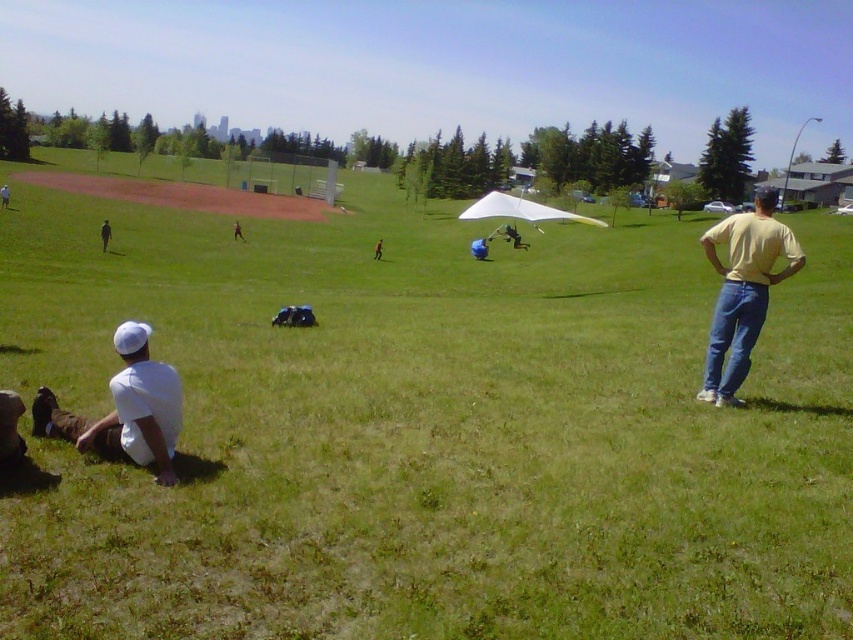
Question: Where is yellow matte shirt at right located in relation to brown fabric backpack at center in the image?

Choices:
 (A) below
 (B) above

Answer: (A)

Question: Can you confirm if white matte shirt at lower left is wider than black fabric person at left?

Choices:
 (A) yes
 (B) no

Answer: (B)

Question: Estimate the real-world distances between objects in this image. Which object is farther from the yellow matte shirt at right?

Choices:
 (A) brown fabric backpack at center
 (B) white matte hang glider at center
 (C) black fabric person at left

Answer: (A)

Question: Which object is positioned farthest from the brown fabric backpack at center?

Choices:
 (A) yellow matte shirt at right
 (B) white matte shirt at lower left

Answer: (B)

Question: Among these objects, which one is nearest to the camera?

Choices:
 (A) white cotton shirt at lower left
 (B) white matte shirt at lower left
 (C) black fabric person at left

Answer: (B)

Question: Does white matte shirt at lower left have a greater width compared to white cotton shirt at lower left?

Choices:
 (A) no
 (B) yes

Answer: (A)